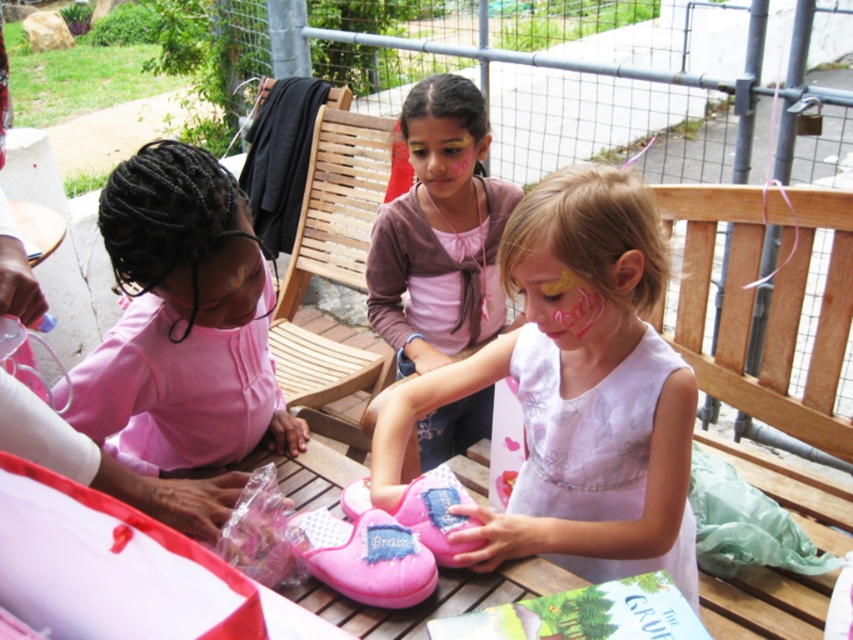
Question: Is pink satin dress at center to the left of pastel pink face paint at center from the viewer's perspective?

Choices:
 (A) no
 (B) yes

Answer: (B)

Question: Which point is farther to the camera?

Choices:
 (A) (190, 454)
 (B) (496, 278)
 (C) (451, 189)

Answer: (B)

Question: Does pink satin dress at left appear on the left side of matte pink face paint at center?

Choices:
 (A) yes
 (B) no

Answer: (A)

Question: Which point appears farthest from the camera in this image?

Choices:
 (A) (451, 188)
 (B) (549, 296)
 (C) (373, 253)

Answer: (C)

Question: Among these objects, which one is farthest from the camera?

Choices:
 (A) pink satin dress at center
 (B) pastel pink face paint at center

Answer: (A)

Question: Can you confirm if pink satin dress at left is positioned to the right of matte pink face paint at center?

Choices:
 (A) yes
 (B) no

Answer: (B)